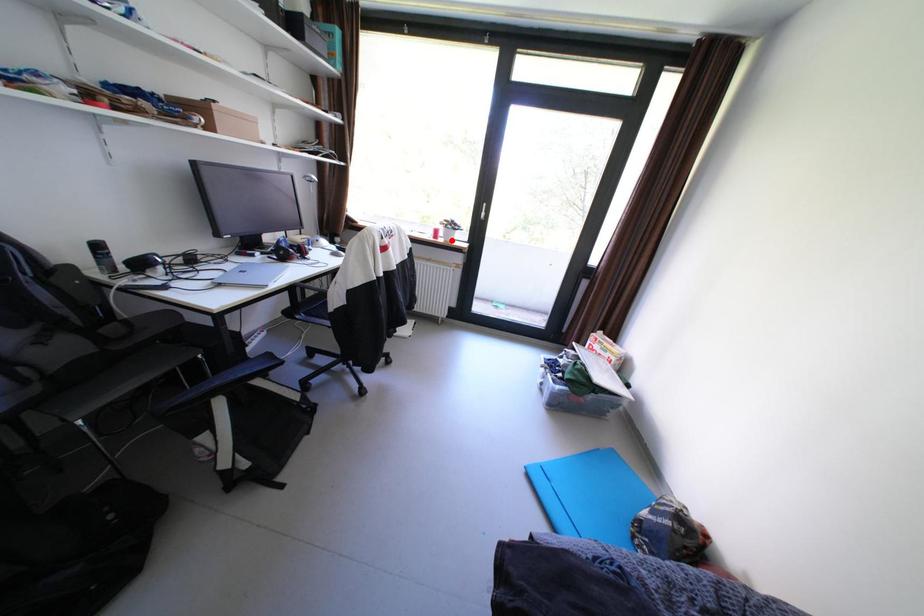
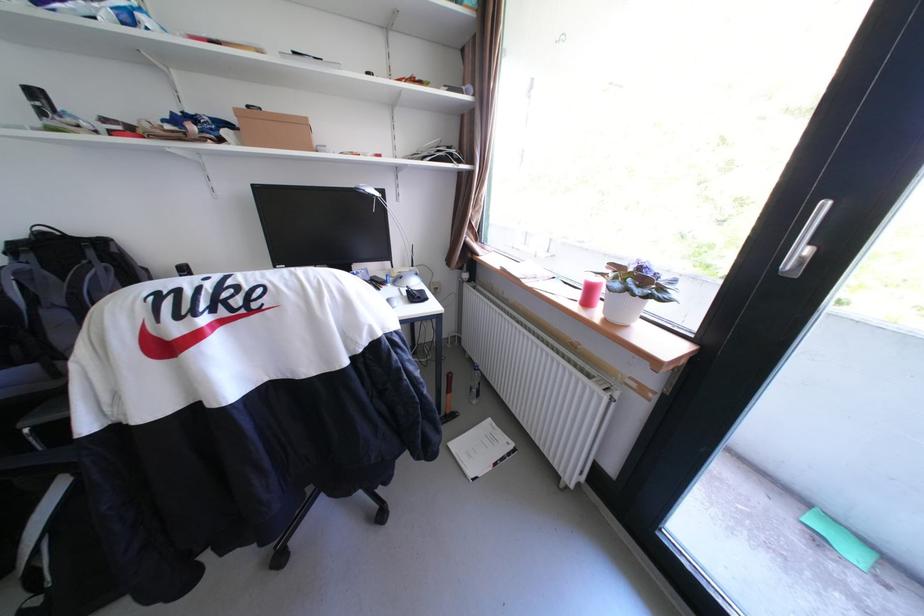
Question: I am providing you with two images of the same scene from different viewpoints. Given a red point in image1, look at the same physical point in image2. Is it:

Choices:
 (A) Closer to the viewpoint
 (B) Farther from the viewpoint

Answer: (B)